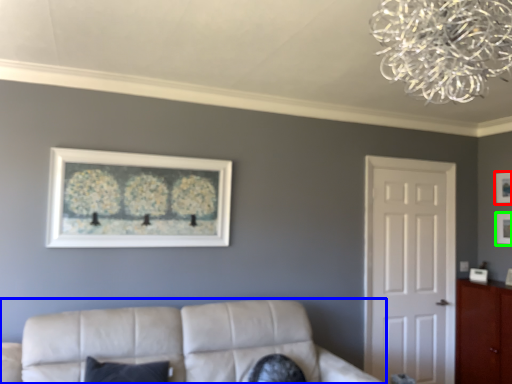
Question: Which is nearer to the picture frame (highlighted by a red box)? studio couch (highlighted by a blue box) or picture frame (highlighted by a green box).

Choices:
 (A) studio couch
 (B) picture frame

Answer: (B)